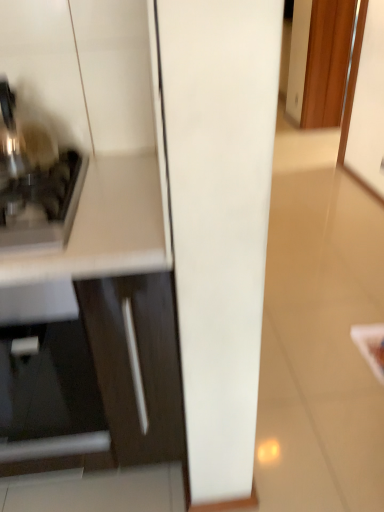
Question: Is the surface of matte white cabinet at left in direct contact with satin silver toaster at left?

Choices:
 (A) yes
 (B) no

Answer: (B)

Question: From a real-world perspective, is matte white cabinet at left over satin silver toaster at left?

Choices:
 (A) yes
 (B) no

Answer: (B)

Question: Can you confirm if matte white cabinet at left is shorter than satin silver toaster at left?

Choices:
 (A) yes
 (B) no

Answer: (B)

Question: Is matte white cabinet at left outside satin silver toaster at left?

Choices:
 (A) no
 (B) yes

Answer: (B)

Question: Is matte white cabinet at left not near satin silver toaster at left?

Choices:
 (A) no
 (B) yes

Answer: (A)

Question: Does matte white cabinet at left have a larger size compared to satin silver toaster at left?

Choices:
 (A) yes
 (B) no

Answer: (A)

Question: Does satin silver toaster at left have a lesser width compared to matte white cabinet at left?

Choices:
 (A) yes
 (B) no

Answer: (A)

Question: Is satin silver toaster at left beside matte white cabinet at left?

Choices:
 (A) yes
 (B) no

Answer: (B)

Question: Considering the relative sizes of satin silver toaster at left and matte white cabinet at left in the image provided, is satin silver toaster at left shorter than matte white cabinet at left?

Choices:
 (A) yes
 (B) no

Answer: (A)

Question: Does satin silver toaster at left appear on the right side of matte white cabinet at left?

Choices:
 (A) no
 (B) yes

Answer: (B)

Question: From the image's perspective, is satin silver toaster at left located above matte white cabinet at left?

Choices:
 (A) no
 (B) yes

Answer: (B)

Question: Could you tell me if satin silver toaster at left is facing matte white cabinet at left?

Choices:
 (A) yes
 (B) no

Answer: (B)

Question: From a real-world perspective, is matte white cabinet at left above or below satin silver toaster at left?

Choices:
 (A) below
 (B) above

Answer: (A)